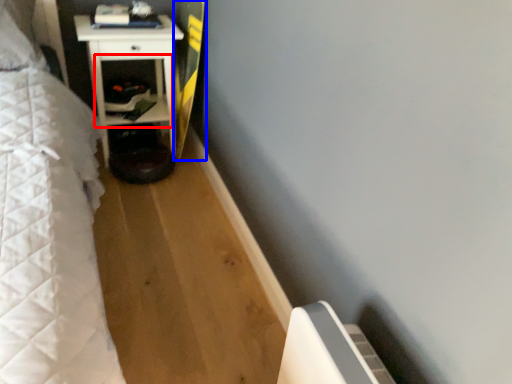
Question: Which object appears farthest to the camera in this image, shelf (highlighted by a red box) or longboard (highlighted by a blue box)?

Choices:
 (A) shelf
 (B) longboard

Answer: (A)